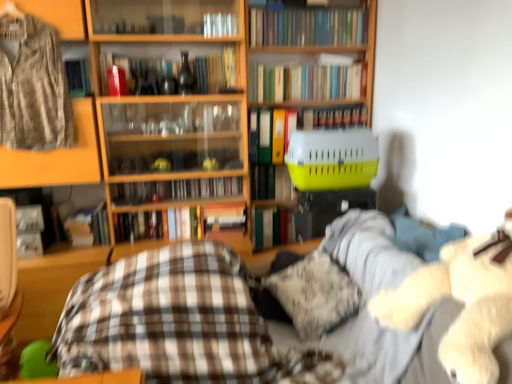
Question: From the image's perspective, is matte glass wine bottle at upper center located above or below fluffy white teddy bear at right?

Choices:
 (A) above
 (B) below

Answer: (A)

Question: Based on their sizes in the image, would you say matte glass wine bottle at upper center is bigger or smaller than fluffy white teddy bear at right?

Choices:
 (A) small
 (B) big

Answer: (A)

Question: Which object is the closest to the hardcover book at center, the fourth book positioned from the bottom?

Choices:
 (A) yellow plastic pet carrier at center
 (B) fluffy white teddy bear at right
 (C) fluffy white pillow at center
 (D) hardcover book at center, which appears as the 9th book when viewed from the top
 (E) hardcover book at center, which is the 3th book in top-to-bottom order

Answer: (D)

Question: Which object is positioned closest to the fluffy white teddy bear at right?

Choices:
 (A) hardcover book at center, the 2th book in the bottom-to-top sequence
 (B) green matte file folder at center, which is the fourth book from top to bottom
 (C) hardcover book at center, acting as the 10th book starting from the top
 (D) yellow plastic pet carrier at center
 (E) hardcover book at center, which is the 6th book from top to bottom

Answer: (A)